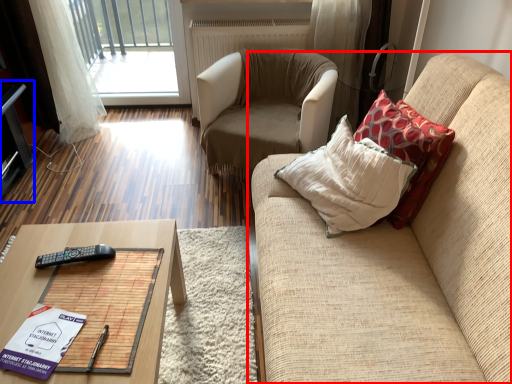
Question: Among these objects, which one is farthest to the camera, studio couch (highlighted by a red box) or entertainment center (highlighted by a blue box)?

Choices:
 (A) studio couch
 (B) entertainment center

Answer: (B)